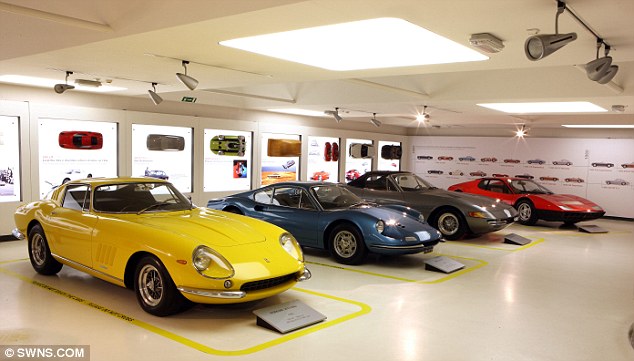
The height and width of the screenshot is (361, 634). Find the location of `skylight`. skylight is located at coordinates (413, 46), (581, 108), (595, 128).